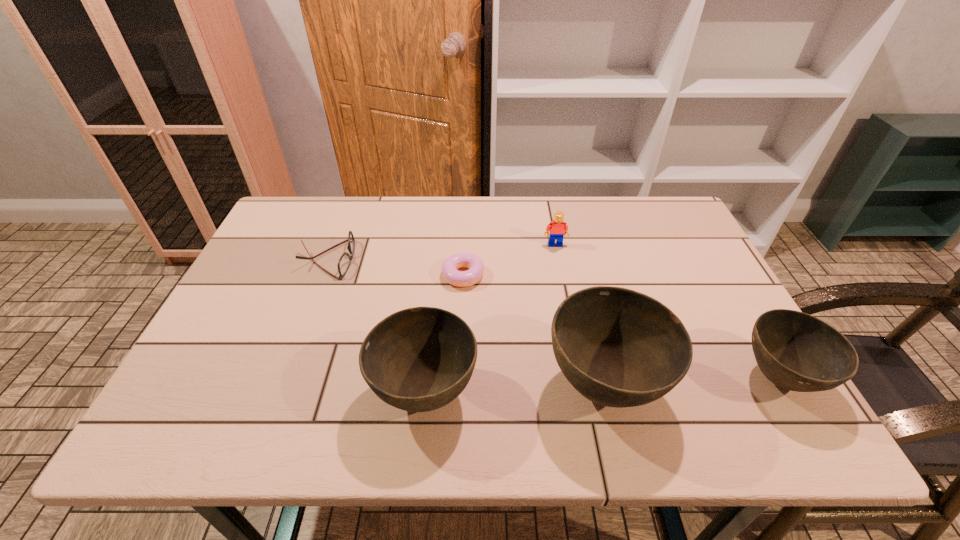
Locate an element on the screen. This screenshot has width=960, height=540. free location located 0.210m on the left of the shortest bowl is located at coordinates (639, 379).

This screenshot has height=540, width=960. Identify the location of vacant region located on the front-facing side of the spectacles. (399, 259).

This screenshot has width=960, height=540. In order to click on free spot located 0.130m on the right of the doughnut in this screenshot , I will do `click(532, 275)`.

At what (x,y) coordinates should I click in order to perform the action: click on free region located 0.240m on the front-facing side of the Lego. Please return your answer as a coordinate pair (x, y). The width and height of the screenshot is (960, 540). Looking at the image, I should click on (567, 307).

Locate an element on the screen. The height and width of the screenshot is (540, 960). object present at the far edge is located at coordinates (344, 262).

Locate an element on the screen. The image size is (960, 540). object present at the left edge is located at coordinates (344, 262).

Locate an element on the screen. object at the right edge is located at coordinates (796, 351).

You are a GUI agent. You are given a task and a screenshot of the screen. Output one action in this format:
    pyautogui.click(x=<x>, y=<y>)
    Task: Click on the object situated at the far left corner
    
    Given the screenshot: What is the action you would take?
    pyautogui.click(x=344, y=262)

Locate an element on the screen. The height and width of the screenshot is (540, 960). object present at the near right corner is located at coordinates tap(796, 351).

Identify the location of free space at the far edge of the desktop. (395, 207).